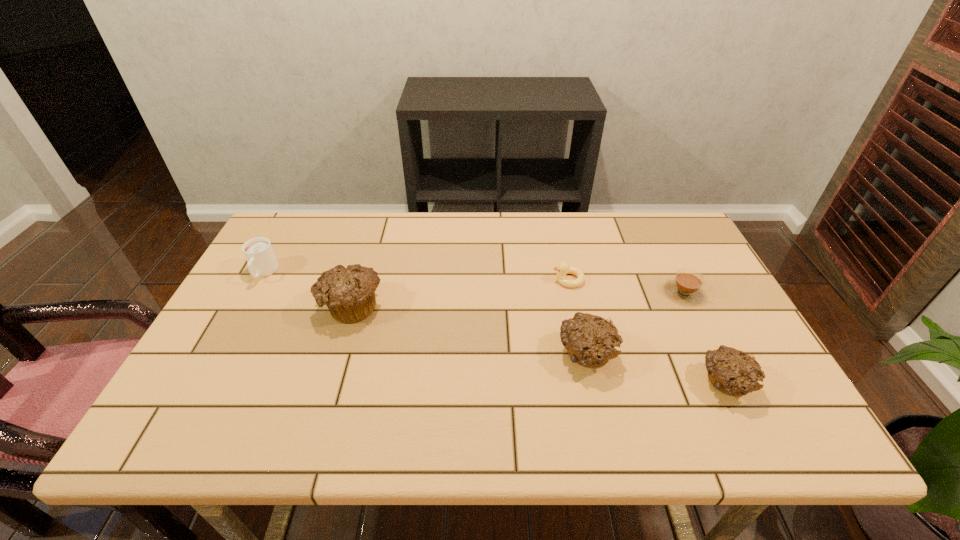
To make them evenly spaced by inserting another muffin among them, please locate a vacant spot for this new muffin. Please provide its 2D coordinates. Your answer should be formatted as a tuple, i.e. [(x, y)], where the tuple contains the x and y coordinates of a point satisfying the conditions above.

[(462, 329)]